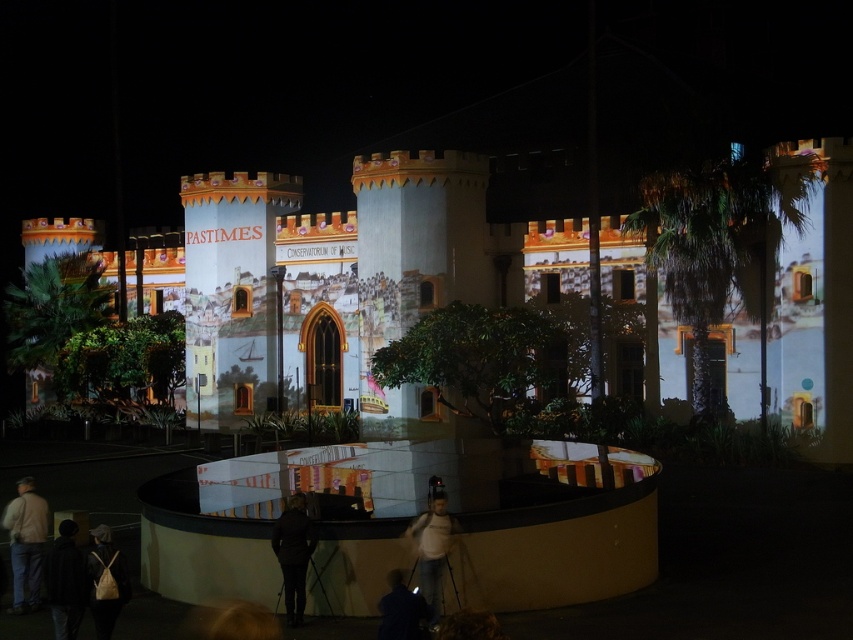
You are standing in front of the nighttime scene with the matte white castle at center and the white matte shirt at center. Which object would you look up to see?

The matte white castle at center is above the white matte shirt at center, so you would need to look up to see the matte white castle at center.

You are a fashion designer observing the nighttime scene at the castle. You notice the dark brown leather jacket at center and the white matte shirt at center. Which clothing item is positioned higher on the person wearing them?

The dark brown leather jacket at center is located above the white matte shirt at center, so it is positioned higher on the person wearing them.

You are standing in front of the castle structure and notice two items at the lower left corner of the image. Which item is wider between the light beige jacket at lower left and the leather backpack at lower left?

The light beige jacket at lower left is wider than the leather backpack at lower left according to the description.